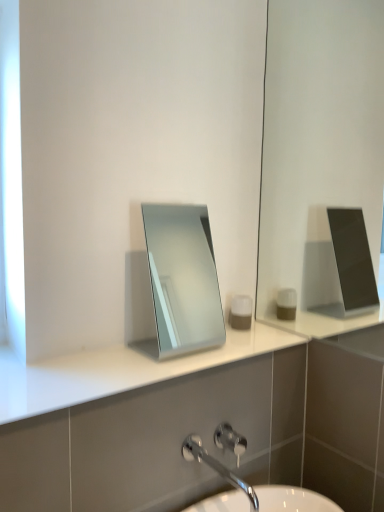
Locate an element on the screen. Image resolution: width=384 pixels, height=512 pixels. vacant area that is in front of matte gray container at center is located at coordinates (236, 345).